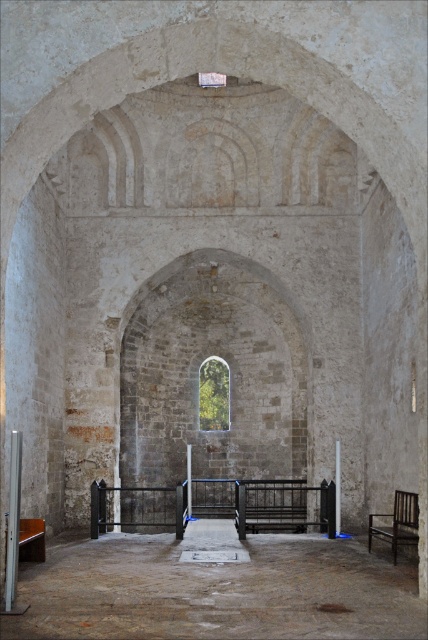
You are standing at the entrance of the historical stone structure and see the brown stone floor at center and the wooden bench at lower left. Which object is taller from your perspective?

The brown stone floor at center is much taller than the wooden bench at lower left from your perspective.

You are standing at the entrance of the historical stone structure. You see a point marked at coordinates (x=216, y=589). What is located at that point?

The point at coordinates (x=216, y=589) corresponds to the brown stone floor at center.